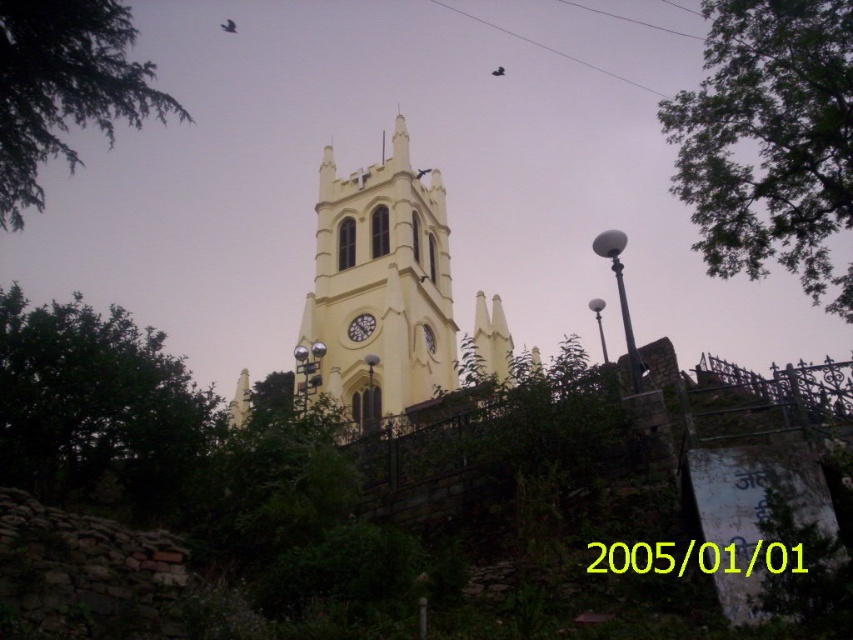
You are an architect planning to install a new lighting system around the yellow church tower. You notice two green leafy trees in the image. Which tree, the green leafy tree at upper right or the green leafy tree at left, would require a taller lighting pole to ensure proper illumination?

The green leafy tree at upper right is taller than the green leafy tree at left, so it would require a taller lighting pole to ensure proper illumination.

In the scene shown: You are standing at the base of the yellow matte tower at center and want to take a photo. If your camera has a maximum focus range of 70 meters, will it be able to capture the tower clearly?

The yellow matte tower at center and camera are 73.40 meters apart. Since the camera can only focus up to 70 meters, it will not be able to capture the tower clearly.